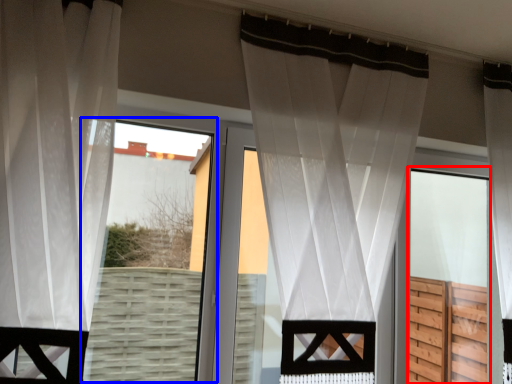
Question: Which point is further to the camera, screen door (highlighted by a red box) or bay window (highlighted by a blue box)?

Choices:
 (A) screen door
 (B) bay window

Answer: (A)